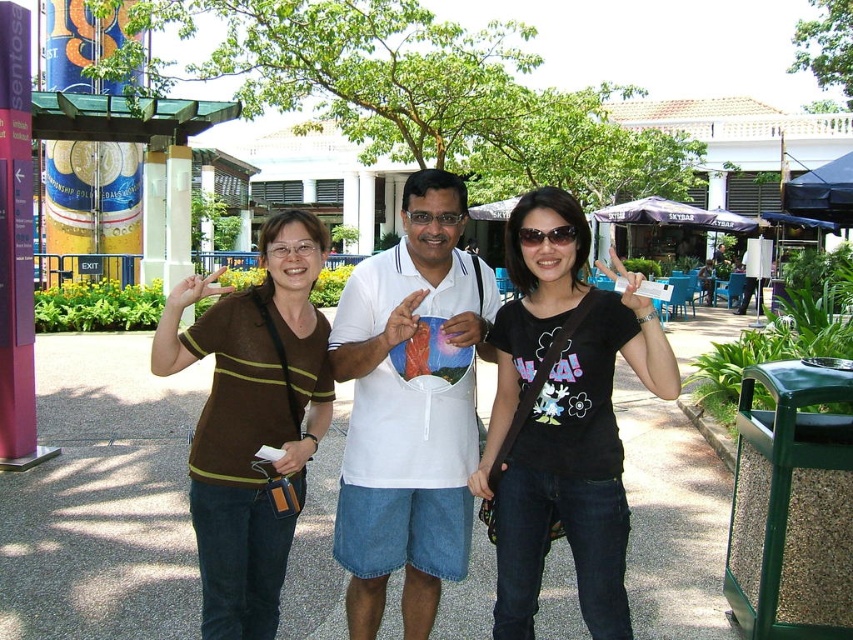
You are a photographer trying to capture a group photo of the three people. You notice the brown striped shirt at left and the matte white glasses at center. Which object is positioned lower in the image?

The brown striped shirt at left is located below matte white glasses at center, so the brown striped shirt at left is positioned lower in the image.

You are a photographer trying to capture a group photo of three people. You notice the brown striped shirt at left and the matte white glasses at center. Based on their heights, which one might you need to adjust the camera angle for to ensure both are framed properly?

The brown striped shirt at left is much taller than the matte white glasses at center, so you might need to lower the camera angle slightly to include the entire body of the shorter person while keeping the taller person in frame.